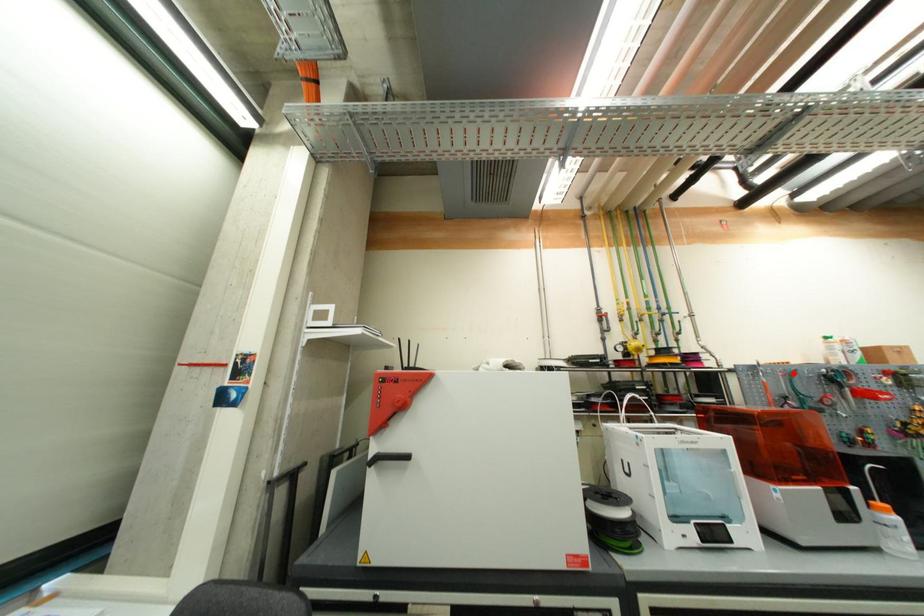
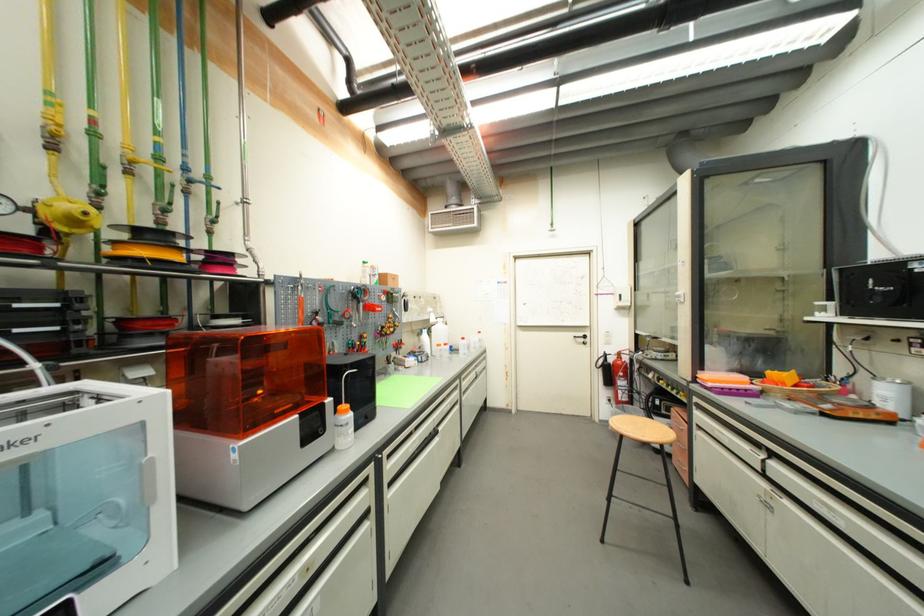
In the second image, find the point that corresponds to the highlighted location in the first image.

(334, 289)